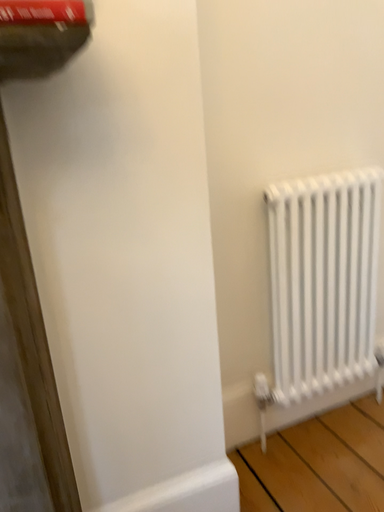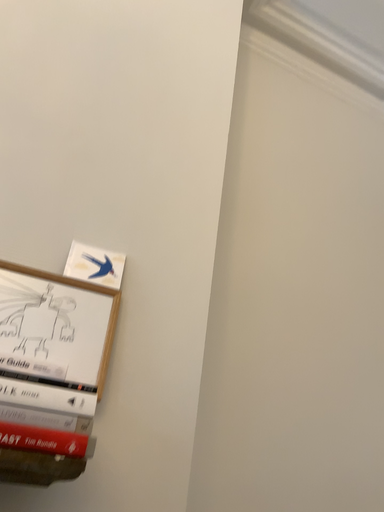
Question: Which way did the camera rotate in the video?

Choices:
 (A) rotated downward
 (B) rotated upward

Answer: (B)